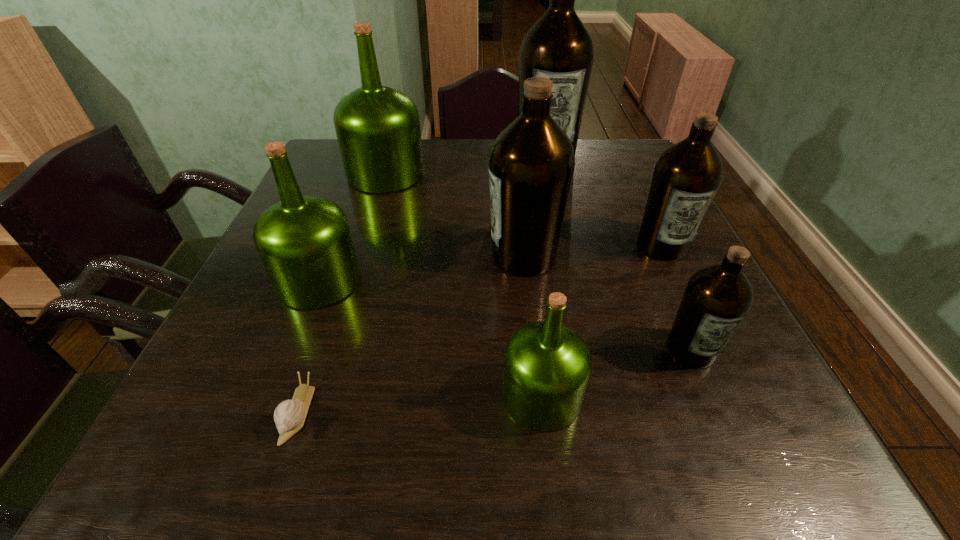
Where is `the farthest brown olive oil`? The height and width of the screenshot is (540, 960). the farthest brown olive oil is located at coordinates [558, 46].

In order to click on the tallest olive oil in this screenshot , I will do `click(558, 46)`.

Locate an element on the screen. The width and height of the screenshot is (960, 540). the farthest green olive oil is located at coordinates (378, 130).

The height and width of the screenshot is (540, 960). What are the coordinates of `the second biggest brown olive oil` in the screenshot? It's located at (531, 164).

Find the location of `the third biggest brown olive oil`. the third biggest brown olive oil is located at coordinates (686, 177).

Identify the location of the second nearest green olive oil. (305, 244).

Identify the location of the smallest brown olive oil. Image resolution: width=960 pixels, height=540 pixels. (716, 299).

Image resolution: width=960 pixels, height=540 pixels. Identify the location of the smallest green olive oil. (547, 365).

Identify the location of the nearest green olive oil. The height and width of the screenshot is (540, 960). (547, 365).

At what (x,y) coordinates should I click in order to perform the action: click on escargot. Please return your answer as a coordinate pair (x, y). The width and height of the screenshot is (960, 540). Looking at the image, I should click on (289, 416).